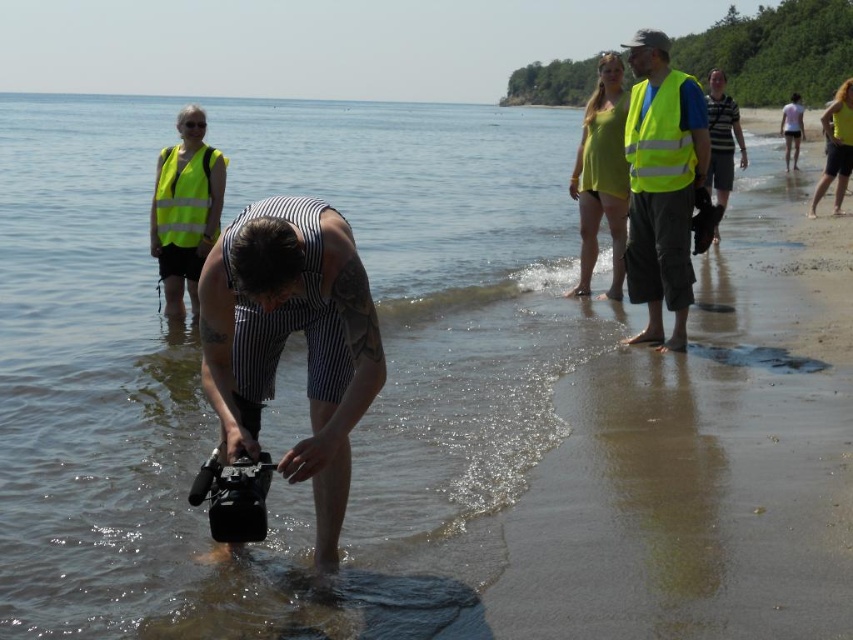
Question: Can you confirm if high visibility vest at right is positioned below yellow reflective vest at upper center?

Choices:
 (A) yes
 (B) no

Answer: (B)

Question: Does high visibility vest at upper left have a lesser width compared to yellow matte dress at upper right?

Choices:
 (A) yes
 (B) no

Answer: (A)

Question: Which of the following is the closest to the observer?

Choices:
 (A) (361, 294)
 (B) (171, 212)

Answer: (A)

Question: Which object is farther from the camera taking this photo?

Choices:
 (A) yellow reflective vest at upper center
 (B) yellow reflective vest at upper left
 (C) striped fabric shirt at center

Answer: (B)

Question: Which of the following is the closest to the observer?

Choices:
 (A) striped fabric shirt at center
 (B) high visibility vest at right

Answer: (B)

Question: Does high visibility vest at right have a smaller size compared to yellow matte tank top at upper right?

Choices:
 (A) no
 (B) yes

Answer: (B)